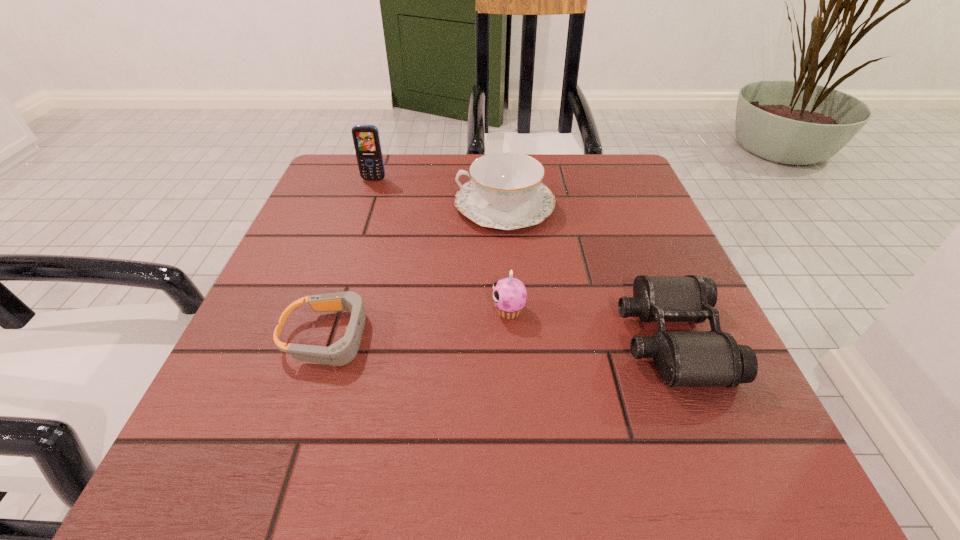
Locate an element on the screen. The width and height of the screenshot is (960, 540). free space between the tallest object and the fourth tallest object is located at coordinates (522, 259).

Locate an element on the screen. This screenshot has width=960, height=540. vacant point located between the chinaware and the cellular telephone is located at coordinates (440, 192).

This screenshot has width=960, height=540. I want to click on vacant space that is in between the rightmost object and the chinaware, so click(x=588, y=272).

At what (x,y) coordinates should I click in order to perform the action: click on free space between the tallest object and the chinaware. Please return your answer as a coordinate pair (x, y). Looking at the image, I should click on (440, 192).

Identify the location of vacant space in between the chinaware and the goggles. (418, 271).

Image resolution: width=960 pixels, height=540 pixels. What are the coordinates of `free space between the cupcake and the rightmost object` in the screenshot? It's located at (590, 325).

Locate an element on the screen. The image size is (960, 540). unoccupied area between the chinaware and the binoculars is located at coordinates (588, 272).

Locate an element on the screen. Image resolution: width=960 pixels, height=540 pixels. vacant point located between the chinaware and the tallest object is located at coordinates (440, 192).

The width and height of the screenshot is (960, 540). Find the location of `blank region between the cupcake and the rightmost object`. blank region between the cupcake and the rightmost object is located at coordinates (590, 325).

Locate an element on the screen. The height and width of the screenshot is (540, 960). vacant region between the goggles and the chinaware is located at coordinates (418, 271).